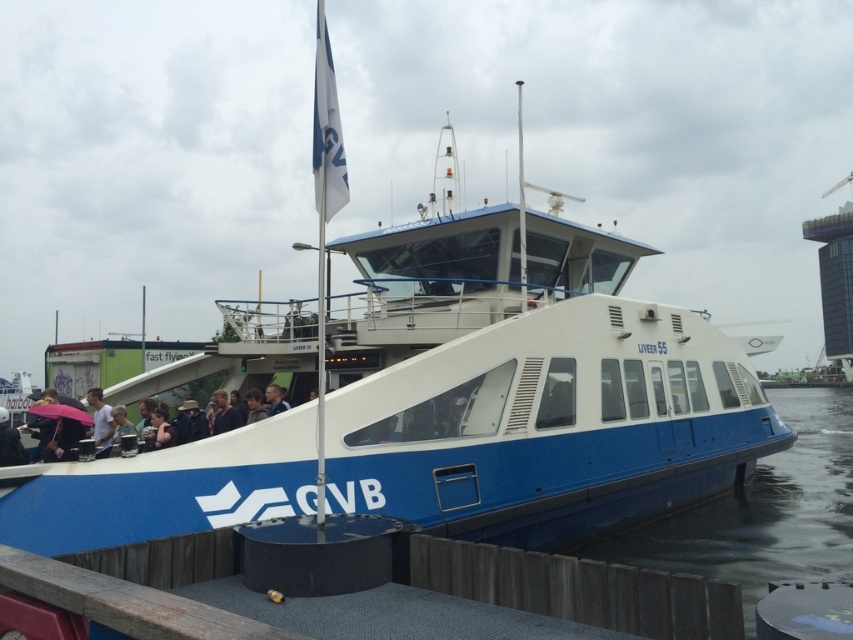
Question: In this image, where is blue matte boat at center located relative to light blue shirt at lower left?

Choices:
 (A) left
 (B) right

Answer: (B)

Question: Can you confirm if blue rubber boat at lower center is positioned below light blue shirt at lower left?

Choices:
 (A) yes
 (B) no

Answer: (A)

Question: Estimate the real-world distances between objects in this image. Which object is farther from the blue rubber boat at lower center?

Choices:
 (A) blue matte boat at center
 (B) light blue shirt at lower left

Answer: (B)

Question: Among these points, which one is farthest from the camera?

Choices:
 (A) (105, 452)
 (B) (485, 381)
 (C) (711, 515)

Answer: (C)

Question: Which of these objects is positioned farthest from the blue matte boat at center?

Choices:
 (A) blue rubber boat at lower center
 (B) light blue shirt at lower left

Answer: (B)

Question: In this image, where is blue rubber boat at lower center located relative to light blue shirt at lower left?

Choices:
 (A) below
 (B) above

Answer: (A)